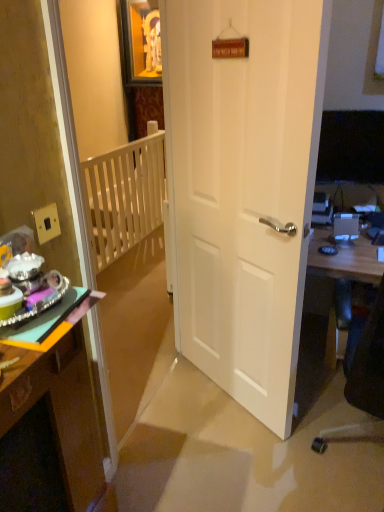
Question: Choose the correct answer: Is white wooden bunk bed at upper left inside wooden desk at right or outside it?

Choices:
 (A) inside
 (B) outside

Answer: (B)

Question: Does point (125, 150) appear closer or farther from the camera than point (367, 248)?

Choices:
 (A) closer
 (B) farther

Answer: (B)

Question: Estimate the real-world distances between objects in this image. Which object is closer to the white wooden balustrade at left?

Choices:
 (A) wooden desk at right
 (B) white wooden bunk bed at upper left
 (C) wooden desk at left
 (D) white matte door at center

Answer: (B)

Question: Which object is the closest to the white wooden balustrade at left?

Choices:
 (A) white matte door at center
 (B) white wooden bunk bed at upper left
 (C) wooden desk at right
 (D) wooden desk at left

Answer: (B)